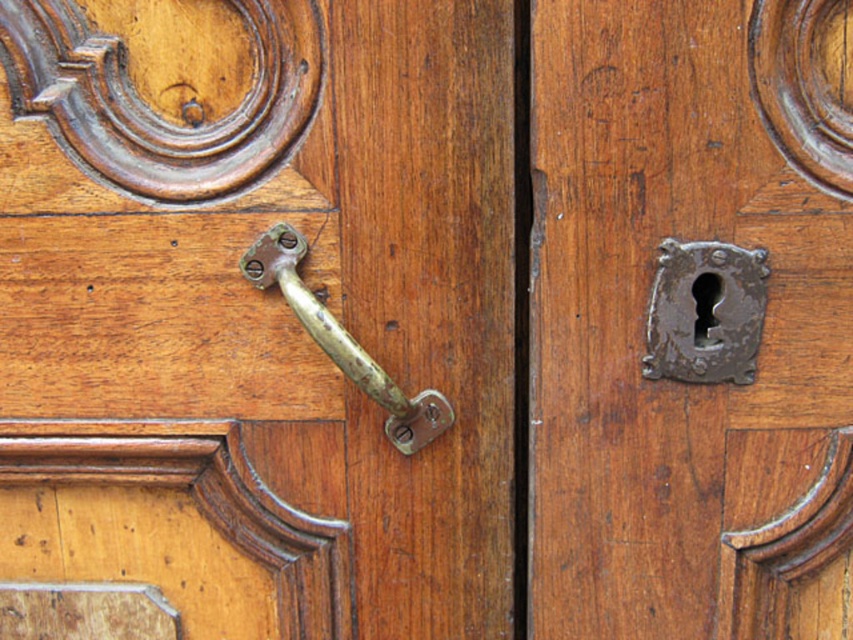
Can you confirm if rusty metal keyhole at right is bigger than gold polished metal door handle at center?

A: No, rusty metal keyhole at right is not bigger than gold polished metal door handle at center.

Is rusty metal keyhole at right above gold polished metal door handle at center?

Correct, rusty metal keyhole at right is located above gold polished metal door handle at center.

This screenshot has width=853, height=640. What do you see at coordinates (705, 312) in the screenshot?
I see `rusty metal keyhole at right` at bounding box center [705, 312].

What are the coordinates of `rusty metal keyhole at right` in the screenshot? It's located at (705, 312).

Does brass/bronze handle at center appear on the right side of rusty metal keyhole at right?

In fact, brass/bronze handle at center is to the left of rusty metal keyhole at right.

Can you confirm if brass/bronze handle at center is wider than rusty metal keyhole at right?

Indeed, brass/bronze handle at center has a greater width compared to rusty metal keyhole at right.

At what (x,y) coordinates should I click in order to perform the action: click on brass/bronze handle at center. Please return your answer as a coordinate pair (x, y). This screenshot has height=640, width=853. Looking at the image, I should click on (264, 308).

Who is higher up, brass/bronze handle at center or rusty metal keyhole at center?

brass/bronze handle at center is higher up.

Does brass/bronze handle at center appear on the right side of rusty metal keyhole at center?

In fact, brass/bronze handle at center is to the left of rusty metal keyhole at center.

Who is more distant from viewer, (181, 476) or (650, 397)?

Positioned behind is point (181, 476).

Where is `brass/bronze handle at center`? brass/bronze handle at center is located at coordinates (264, 308).